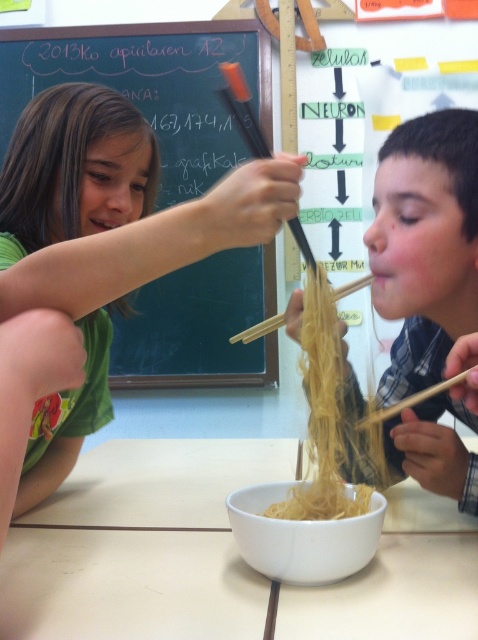
You are a student sitting at a desk in the classroom. You notice two points marked on the chalkboard. The first point is labeled as point [26,64] and the second is point [341,554]. From your perspective, which point is closer to you?

Point [26,64] is behind point [341,554], so the closer point to you is point [341,554].

You are a robot trying to navigate between two points in the classroom. The first point is point (445, 387) and the second is point (351, 284). Which point is closer to the chalkboard?

Point (351, 284) is closer to the chalkboard because it is behind point (445, 387).

You are a student in the classroom and need to hang a poster on the wall. The poster is as tall as the wooden chopstick at right. Will it fit vertically on the chalkboard at upper left?

The chalkboard at upper left is taller than the wooden chopstick at right, so the poster will fit vertically on the chalkboard at upper left since it is taller than the chopstick.